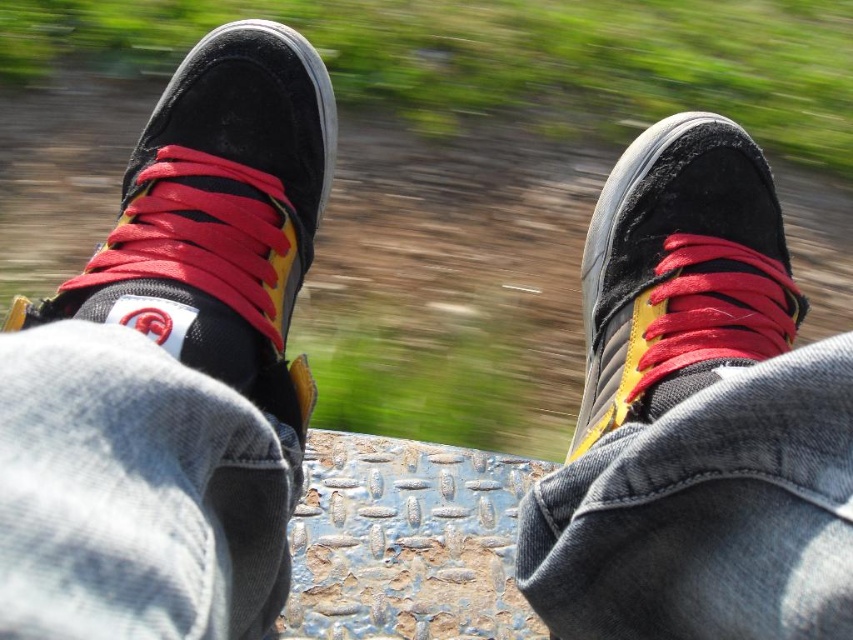
Question: Which object appears farthest from the camera in this image?

Choices:
 (A) suede/black shoe at upper left
 (B) suede/black shoe at center

Answer: (B)

Question: Does suede/black shoe at upper left appear on the right side of suede/black shoe at center?

Choices:
 (A) no
 (B) yes

Answer: (A)

Question: Is suede/black shoe at upper left further to the viewer compared to suede/black shoe at center?

Choices:
 (A) yes
 (B) no

Answer: (B)

Question: Does suede/black shoe at upper left appear over suede/black shoe at center?

Choices:
 (A) no
 (B) yes

Answer: (B)